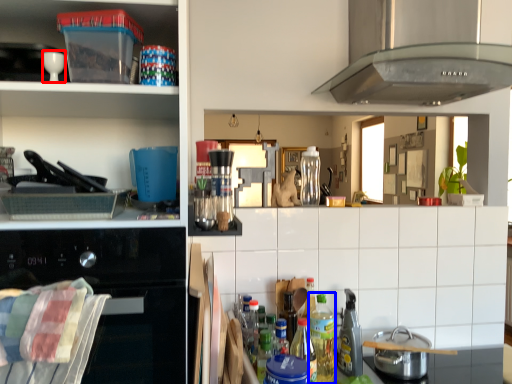
Question: Which point is closer to the camera, appliance (highlighted by a red box) or bottle (highlighted by a blue box)?

Choices:
 (A) appliance
 (B) bottle

Answer: (A)